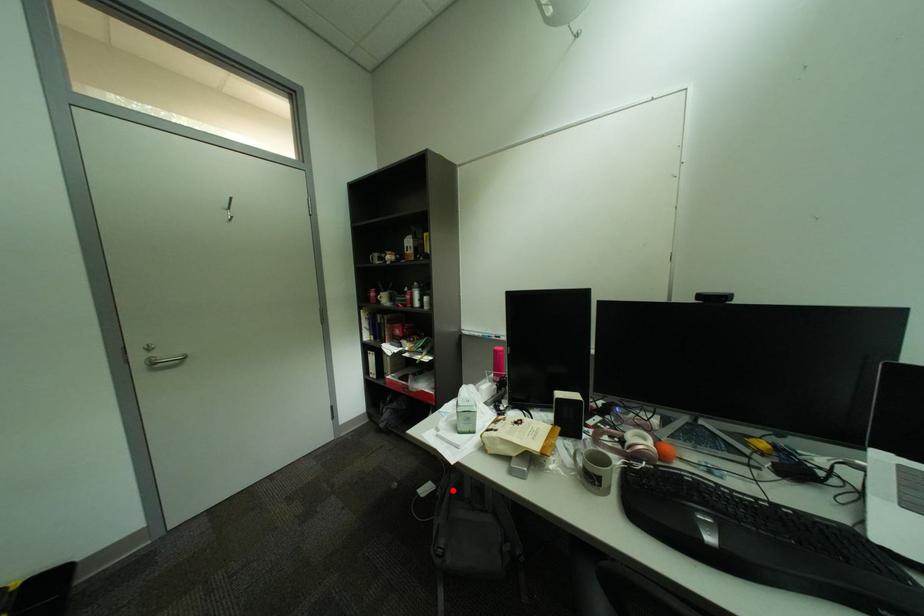
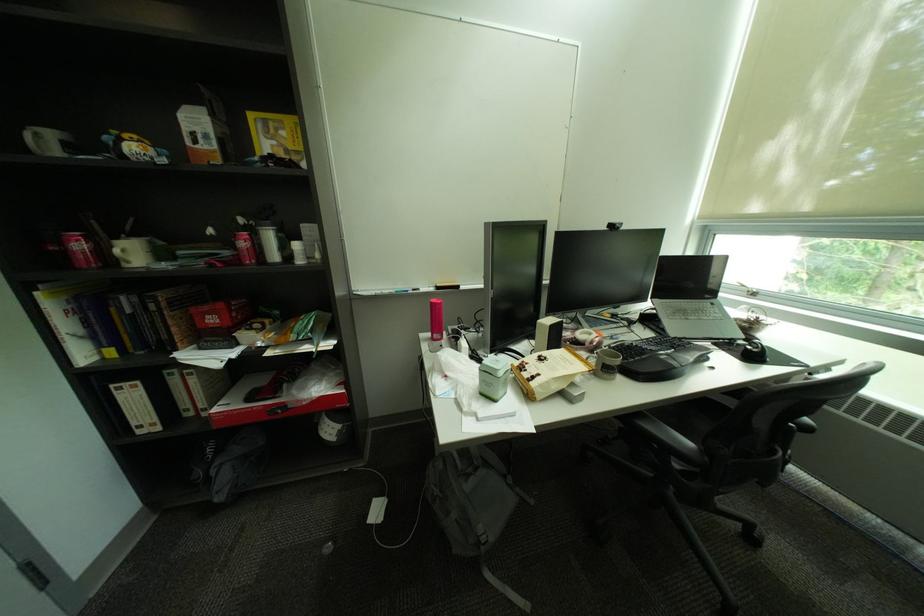
Question: A red point is marked in image1. In image2, is the corresponding 3D point closer to the camera or farther? Reply with the corresponding letter.

Choices:
 (A) The corresponding 3D point is closer.
 (B) The corresponding 3D point is farther.

Answer: (A)